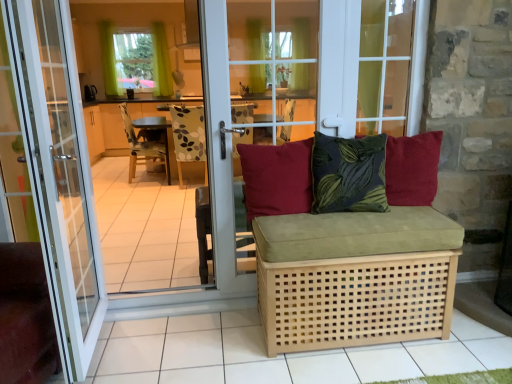
Image resolution: width=512 pixels, height=384 pixels. I want to click on green fabric curtain at upper left, positioned as the 2th curtain in right-to-left order, so click(108, 59).

Image resolution: width=512 pixels, height=384 pixels. What are the coordinates of `patterned fabric chair at center` in the screenshot? It's located at (189, 137).

In order to face light brown woven studio couch at center, should I rotate leftwards or rightwards?

A 12.046 degree turn to the right will do.

Image resolution: width=512 pixels, height=384 pixels. Describe the element at coordinates (350, 253) in the screenshot. I see `light brown woven studio couch at center` at that location.

What do you see at coordinates (145, 141) in the screenshot? This screenshot has width=512, height=384. I see `wooden chair at center` at bounding box center [145, 141].

You are a GUI agent. You are given a task and a screenshot of the screen. Output one action in this format:
    pyautogui.click(x=<x>, y=<y>)
    Task: Click on the dark green velvet cushion at center, the second pillow when ordered from left to right
    The width and height of the screenshot is (512, 384).
    Given the screenshot: What is the action you would take?
    pyautogui.click(x=348, y=174)

I want to click on transparent glass door at center, so click(308, 86).

Find the location of a particular element. The image size is (512, 384). natural wood tile at lower center is located at coordinates (278, 355).

Does white glass door at center have a larger size compared to green fabric curtain at upper center, which is the 1th curtain from right to left?

Yes, white glass door at center is bigger than green fabric curtain at upper center, which is the 1th curtain from right to left.

I want to click on door on the right of green fabric curtain at upper center, placed as the second curtain when sorted from left to right, so tap(61, 169).

From the image's perspective, would you say white glass door at center is shown under green fabric curtain at upper center, which is the 1th curtain from right to left?

Yes, from the image's perspective, white glass door at center is below green fabric curtain at upper center, which is the 1th curtain from right to left.

Would you say white glass door at center contains green fabric curtain at upper center, placed as the second curtain when sorted from left to right?

Definitely not — green fabric curtain at upper center, placed as the second curtain when sorted from left to right, is not inside white glass door at center.

From a real-world perspective, is matte red cushion at center, the 1th pillow viewed from the left, on natural wood tile at lower center?

Yes.

Does matte red cushion at center, marked as the 3th pillow in a right-to-left arrangement, have a larger size compared to natural wood tile at lower center?

Incorrect, matte red cushion at center, marked as the 3th pillow in a right-to-left arrangement, is not larger than natural wood tile at lower center.

In the scene shown: Is matte red cushion at center, marked as the 3th pillow in a right-to-left arrangement, not close to natural wood tile at lower center?

matte red cushion at center, marked as the 3th pillow in a right-to-left arrangement, is near natural wood tile at lower center, not far away.

From the image's perspective, which is below, matte red cushion at center, the 1th pillow viewed from the left, or natural wood tile at lower center?

natural wood tile at lower center appears lower in the image.

Which of these two, red cotton cushion at center, the third pillow from the left, or dark green velvet cushion at center, the second pillow when ordered from left to right, is wider?

With larger width is dark green velvet cushion at center, the second pillow when ordered from left to right.

Considering their positions, is red cotton cushion at center, the third pillow from the left, located in front of or behind dark green velvet cushion at center, the second pillow when ordered from left to right?

red cotton cushion at center, the third pillow from the left, is behind dark green velvet cushion at center, the second pillow when ordered from left to right.

Can we say red cotton cushion at center, the third pillow from the left, lies outside dark green velvet cushion at center, the second pillow when ordered from left to right?

Indeed, red cotton cushion at center, the third pillow from the left, is completely outside dark green velvet cushion at center, the second pillow when ordered from left to right.

Can you confirm if natural wood tile at lower center is shorter than dark green velvet cushion at center, the second pillow when ordered from left to right?

Yes.

Which is behind, point (225, 346) or point (327, 187)?

The point (327, 187) is more distant.

Is natural wood tile at lower center facing towards dark green velvet cushion at center, the second pillow when ordered from left to right?

No, natural wood tile at lower center is not oriented towards dark green velvet cushion at center, the second pillow when ordered from left to right.

Can you tell me how much transparent glass door at center and red cotton cushion at center, the first pillow when ordered from right to left, differ in facing direction?

transparent glass door at center and red cotton cushion at center, the first pillow when ordered from right to left, are facing 4.49 degrees away from each other.

Is transparent glass door at center at the right side of red cotton cushion at center, the first pillow when ordered from right to left?

No.

Locate an element on the screen. This screenshot has height=384, width=512. glass door lying in front of the red cotton cushion at center, the third pillow from the left is located at coordinates (308, 86).

Can you confirm if transparent glass door at center is bigger than red cotton cushion at center, the third pillow from the left?

Yes.

I want to click on window above the patterned fabric chair at center (from the image's perspective), so click(136, 60).

Which is more to the left, green fabric curtain at upper left, the 2th window in the bottom-to-top sequence, or patterned fabric chair at center?

green fabric curtain at upper left, the 2th window in the bottom-to-top sequence.

Is green fabric curtain at upper left, acting as the first window starting from the left, directly adjacent to patterned fabric chair at center?

No, green fabric curtain at upper left, acting as the first window starting from the left, is not in contact with patterned fabric chair at center.

Is green fabric curtain at upper left, the second window from the front, wider than patterned fabric chair at center?

In fact, green fabric curtain at upper left, the second window from the front, might be narrower than patterned fabric chair at center.

How different are the orientations of green fabric curtain at upper center, placed as the second curtain when sorted from left to right, and red cotton cushion at center, the first pillow when ordered from right to left, in degrees?

4.28 degrees separate the facing orientations of green fabric curtain at upper center, placed as the second curtain when sorted from left to right, and red cotton cushion at center, the first pillow when ordered from right to left.

Does green fabric curtain at upper center, which is the 1th curtain from right to left, have a greater width compared to red cotton cushion at center, the third pillow from the left?

Yes.

Who is smaller, green fabric curtain at upper center, placed as the second curtain when sorted from left to right, or red cotton cushion at center, the first pillow when ordered from right to left?

red cotton cushion at center, the first pillow when ordered from right to left.

Is green fabric curtain at upper center, placed as the second curtain when sorted from left to right, facing away from red cotton cushion at center, the third pillow from the left?

green fabric curtain at upper center, placed as the second curtain when sorted from left to right, is not turned away from red cotton cushion at center, the third pillow from the left.

From the image's perspective, count 2nd curtains upward from the white glass door at center and point to it. Please provide its 2D coordinates.

[(161, 61)]

Find the location of a particular element. The height and width of the screenshot is (384, 512). the 2nd pillow behind the natural wood tile at lower center is located at coordinates (276, 178).

When comparing their distances from transparent glass door at center, does transparent glass window at upper center, acting as the first window starting from the right, or dark green velvet cushion at center, the second pillow when ordered from left to right, seem further?

dark green velvet cushion at center, the second pillow when ordered from left to right, is positioned further to the anchor transparent glass door at center.

Based on the photo, based on their spatial positions, is transparent glass door at center or white glass door at center further from natural wood tile at lower center?

transparent glass door at center lies further to natural wood tile at lower center than the other object.

Based on their spatial positions, is dark green velvet cushion at center, the 2th pillow from the right, or transparent glass window at upper center, which ranks as the 1th window in front-to-back order, closer to transparent glass door at center?

transparent glass window at upper center, which ranks as the 1th window in front-to-back order.

When comparing their distances from wooden chair at center, does light brown woven studio couch at center or green fabric curtain at upper center, which is the 1th curtain from right to left, seem further?

Among the two, light brown woven studio couch at center is located further to wooden chair at center.

From the image, which object appears to be farther from wooden chair at center, dark green velvet cushion at center, the 2th pillow from the right, or white glass door at center?

The object further to wooden chair at center is dark green velvet cushion at center, the 2th pillow from the right.

From the image, which object appears to be farther from red cotton cushion at center, the first pillow when ordered from right to left, transparent glass door at center or green fabric curtain at upper left, positioned as the 2th curtain in right-to-left order?

green fabric curtain at upper left, positioned as the 2th curtain in right-to-left order, lies further to red cotton cushion at center, the first pillow when ordered from right to left, than the other object.

Which object lies nearer to the anchor point transparent glass window at upper center, which ranks as the 1th window in front-to-back order, light brown woven studio couch at center or red cotton cushion at center, the third pillow from the left?

red cotton cushion at center, the third pillow from the left, lies closer to transparent glass window at upper center, which ranks as the 1th window in front-to-back order, than the other object.

Considering their positions, is light brown woven studio couch at center positioned further to green fabric curtain at upper left, acting as the first window starting from the left, than green fabric curtain at upper center, placed as the second curtain when sorted from left to right?

Among the two, light brown woven studio couch at center is located further to green fabric curtain at upper left, acting as the first window starting from the left.

I want to click on pillow between white glass door at center and light brown woven studio couch at center in the horizontal direction, so click(x=276, y=178).

Where is `curtain between transparent glass door at center and green fabric curtain at upper center, which is the 1th curtain from right to left, from front to back`? curtain between transparent glass door at center and green fabric curtain at upper center, which is the 1th curtain from right to left, from front to back is located at coordinates (108, 59).

Find the location of a particular element. The height and width of the screenshot is (384, 512). window between light brown woven studio couch at center and patterned fabric chair at center along the z-axis is located at coordinates (391, 63).

Identify the location of studio couch positioned between white glass door at center and patterned fabric chair at center from near to far. The width and height of the screenshot is (512, 384). (350, 253).